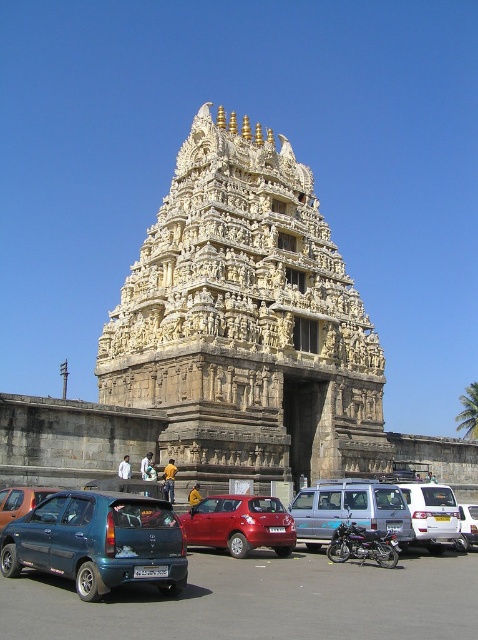
Is metallic red hatchback at center bigger than white cloth at center?

Yes.

Between metallic red hatchback at center and white cloth at center, which one has more height?

With more height is metallic red hatchback at center.

Between point (201, 545) and point (121, 461), which one is positioned in front?

Point (201, 545)

Image resolution: width=478 pixels, height=640 pixels. In order to click on metallic red hatchback at center in this screenshot , I will do `click(239, 524)`.

Can you confirm if silver metallic van at center is positioned below matte blue hatchback at lower left?

Yes.

Is silver metallic van at center wider than matte blue hatchback at lower left?

Yes, silver metallic van at center is wider than matte blue hatchback at lower left.

Is point (393, 515) behind point (2, 497)?

Yes, point (393, 515) is behind point (2, 497).

Identify the location of silver metallic van at center. (349, 509).

Can you confirm if metallic cars at center is thinner than metallic blue hatchback at lower left?

No.

Is point (10, 600) farther from camera compared to point (80, 499)?

No.

Where is `metallic cars at center`? Image resolution: width=478 pixels, height=640 pixels. metallic cars at center is located at coordinates (260, 602).